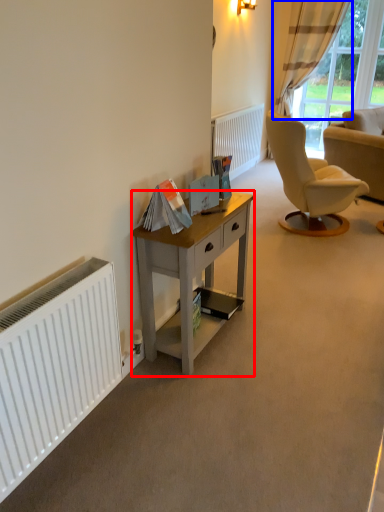
Question: Which point is closer to the camera, desk (highlighted by a red box) or curtain (highlighted by a blue box)?

Choices:
 (A) desk
 (B) curtain

Answer: (A)